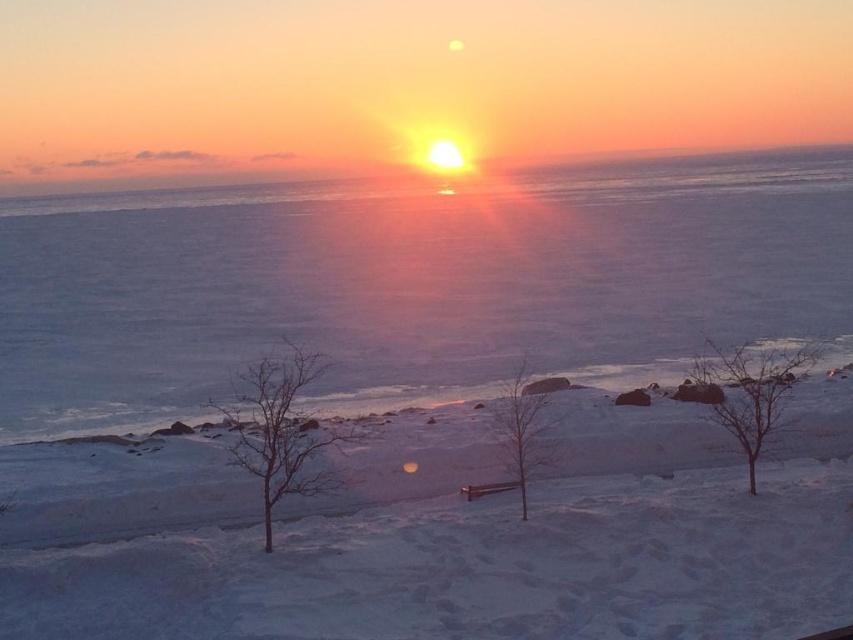
Question: Which of the following is the closest to the observer?

Choices:
 (A) coord(532,467)
 (B) coord(55,502)
 (C) coord(308,456)

Answer: (C)

Question: Is bare branches at center to the right of bare wood tree at center from the viewer's perspective?

Choices:
 (A) yes
 (B) no

Answer: (B)

Question: Estimate the real-world distances between objects in this image. Which object is farther from the bare tree at lower right?

Choices:
 (A) bare branches at center
 (B) bare wood tree at center
 (C) white powdery snow at center

Answer: (C)

Question: Can you confirm if white powdery snow at center is positioned to the left of bare wood tree at center?

Choices:
 (A) no
 (B) yes

Answer: (B)

Question: Among these objects, which one is farthest from the camera?

Choices:
 (A) white powdery snow at center
 (B) bare wood tree at center

Answer: (A)

Question: Can you confirm if bare branches at center is positioned to the right of bare wood tree at center?

Choices:
 (A) yes
 (B) no

Answer: (B)